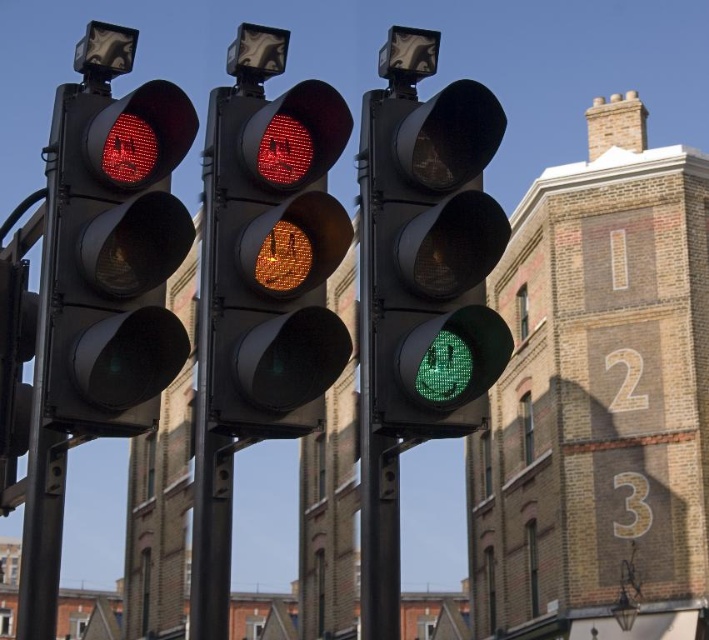
Question: Can you confirm if matte glass traffic light at center is positioned to the right of green matte traffic light at center?

Choices:
 (A) no
 (B) yes

Answer: (A)

Question: Which object appears farthest from the camera in this image?

Choices:
 (A) matte glass traffic light at center
 (B) matte black traffic light at left
 (C) green matte traffic light at center

Answer: (B)

Question: Does matte glass traffic light at center appear on the right side of matte black traffic light at left?

Choices:
 (A) yes
 (B) no

Answer: (A)

Question: Which point appears farthest from the camera in this image?

Choices:
 (A) (101, 177)
 (B) (281, 330)
 (C) (381, 224)

Answer: (A)

Question: Can you confirm if matte glass traffic light at center is positioned to the right of matte black traffic light at left?

Choices:
 (A) no
 (B) yes

Answer: (B)

Question: Which point appears farthest from the camera in this image?

Choices:
 (A) (385, 380)
 (B) (212, 266)
 (C) (77, 332)

Answer: (C)